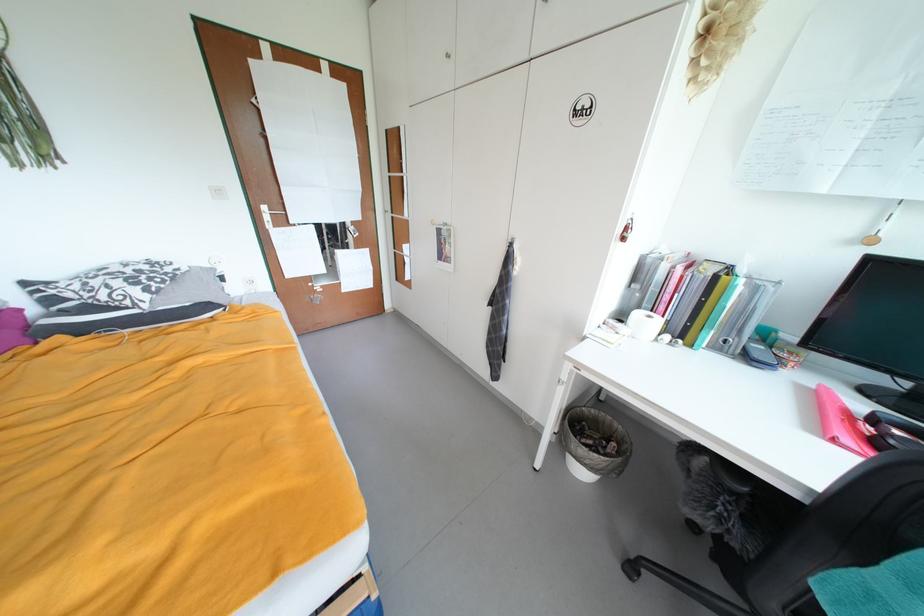
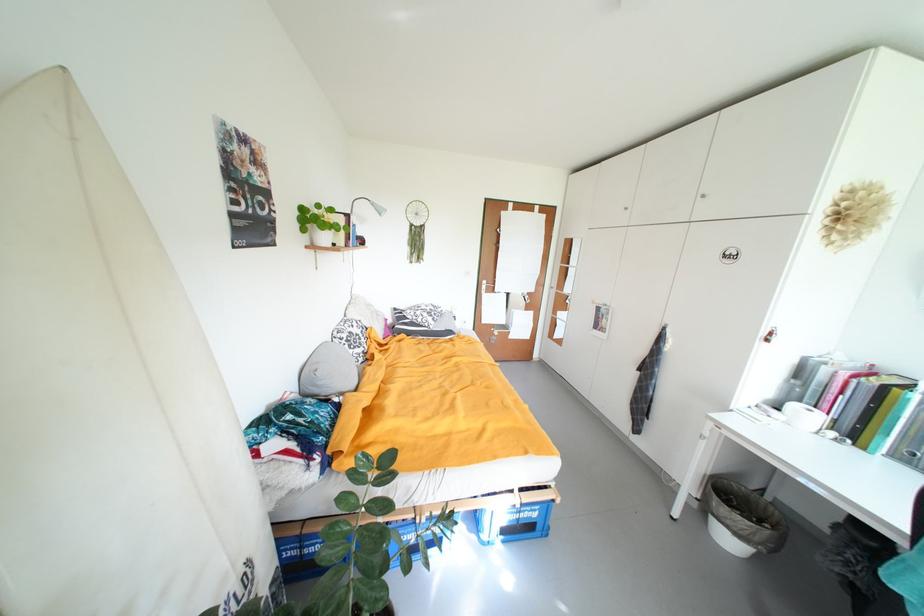
Question: The first image is from the beginning of the video and the second image is from the end. How did the camera likely rotate when shooting the video?

Choices:
 (A) Left
 (B) Right
 (C) Up
 (D) Down

Answer: (A)